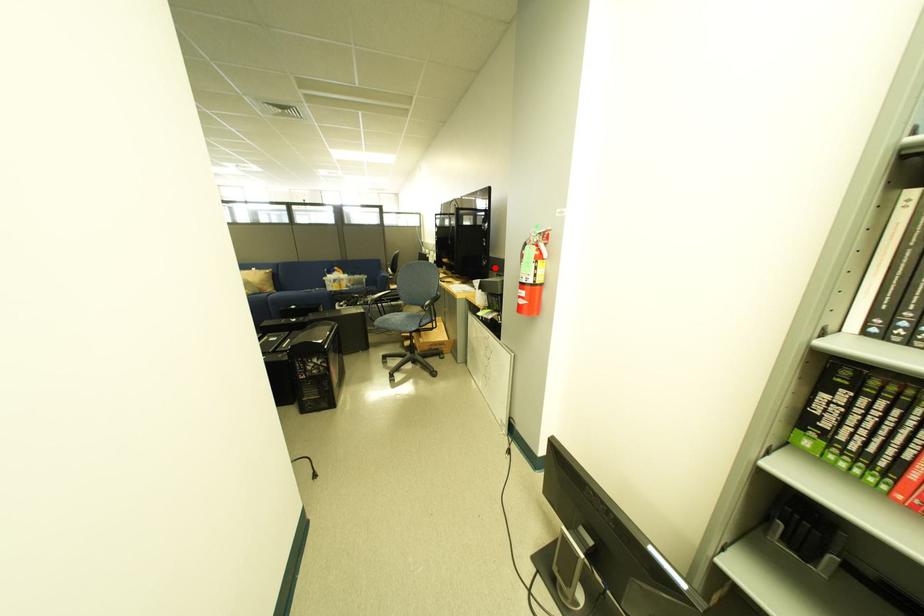
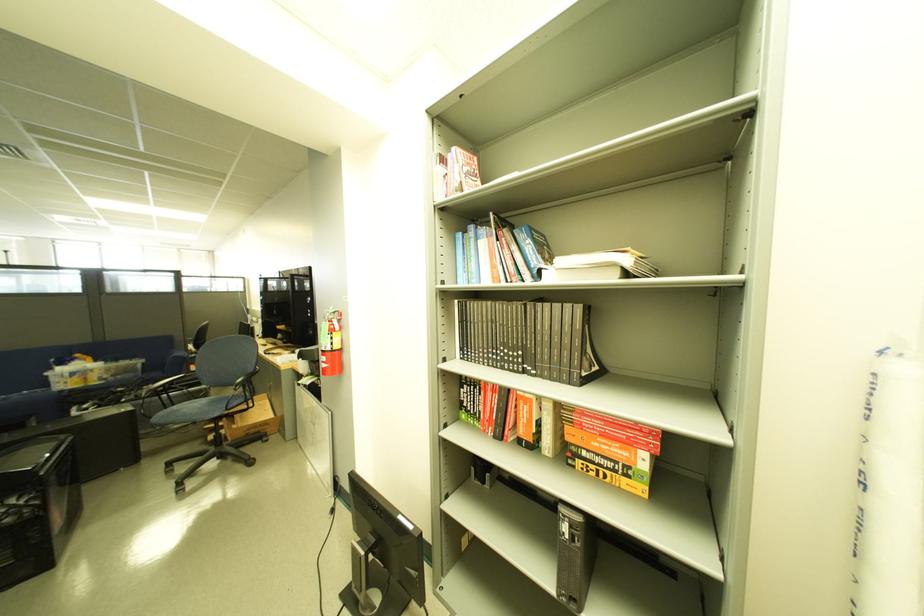
Question: I am providing you with two images of the same scene from different viewpoints. In image1, a red point is highlighted. Considering the same 3D point in image2, which of the following is correct?

Choices:
 (A) It is closer
 (B) It is farther

Answer: (B)